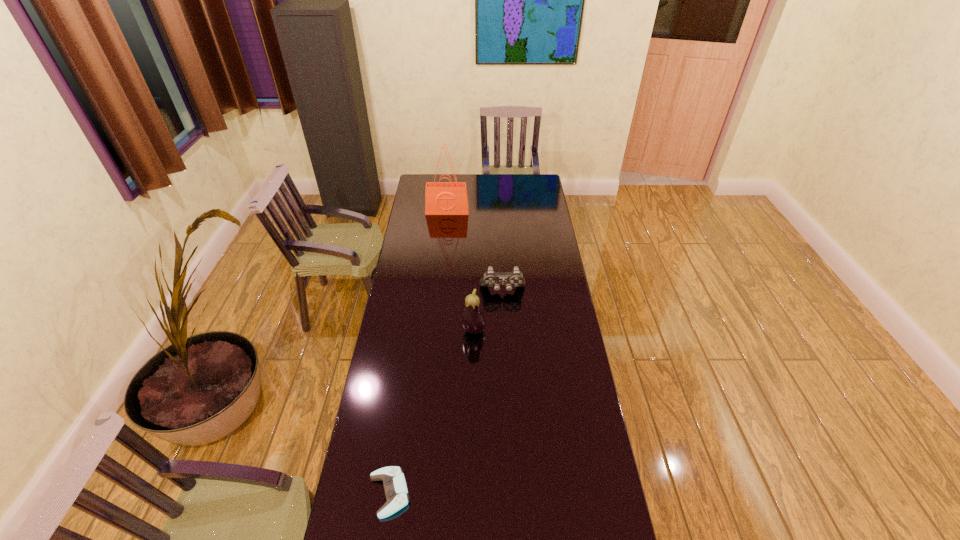
This screenshot has width=960, height=540. What are the coordinates of `free space that satisfies the following two spatial constraints: 1. on the back side of the eggplant; 2. on the right side of the left control` in the screenshot? It's located at (414, 330).

Where is `free space that satisfies the following two spatial constraints: 1. on the logo side of the eggplant; 2. on the left side of the tallest object`? The width and height of the screenshot is (960, 540). free space that satisfies the following two spatial constraints: 1. on the logo side of the eggplant; 2. on the left side of the tallest object is located at coordinates (436, 330).

Image resolution: width=960 pixels, height=540 pixels. In order to click on free space that satisfies the following two spatial constraints: 1. on the logo side of the eggplant; 2. on the right side of the farthest object in this screenshot , I will do `click(436, 330)`.